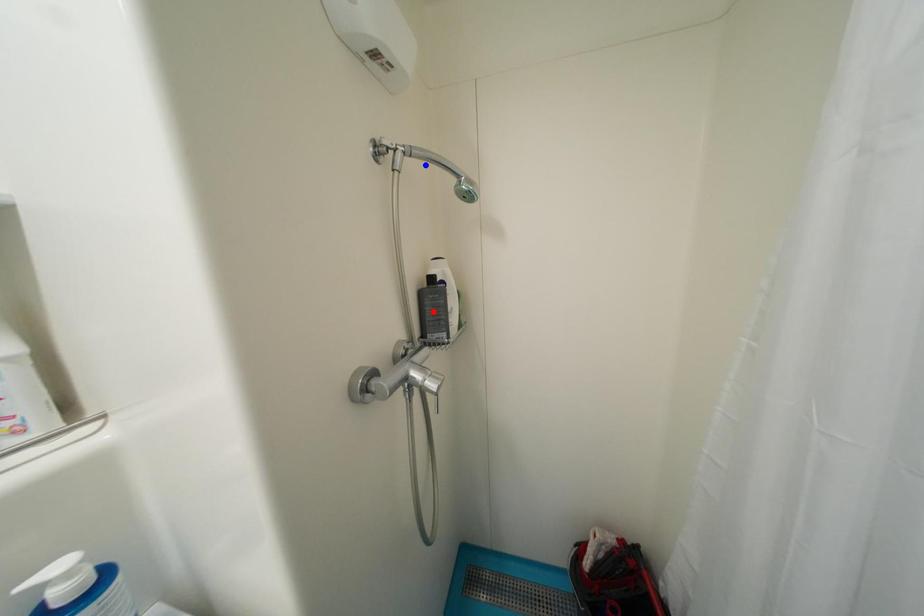
Question: Which of the two points in the image is closer to the camera?

Choices:
 (A) Blue point is closer.
 (B) Red point is closer.

Answer: (A)